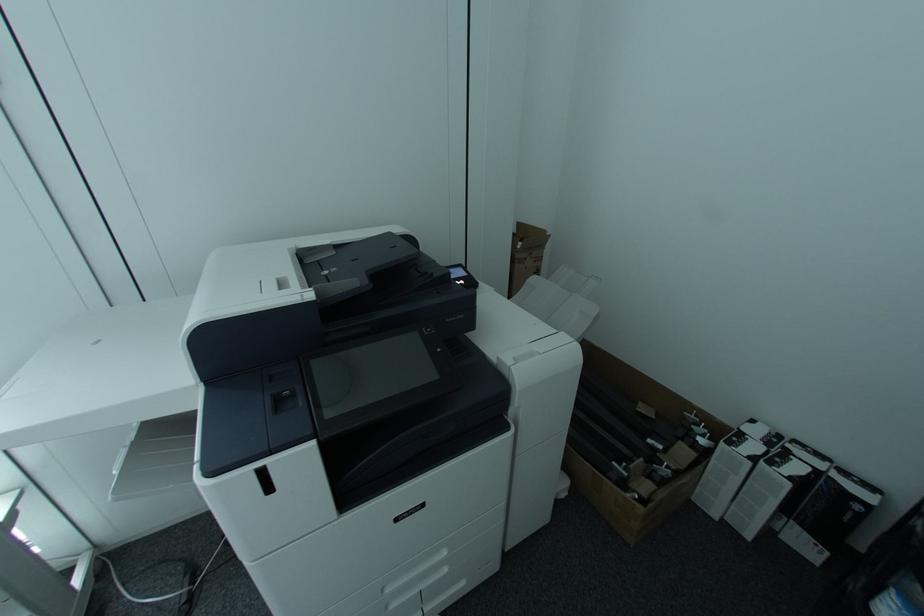
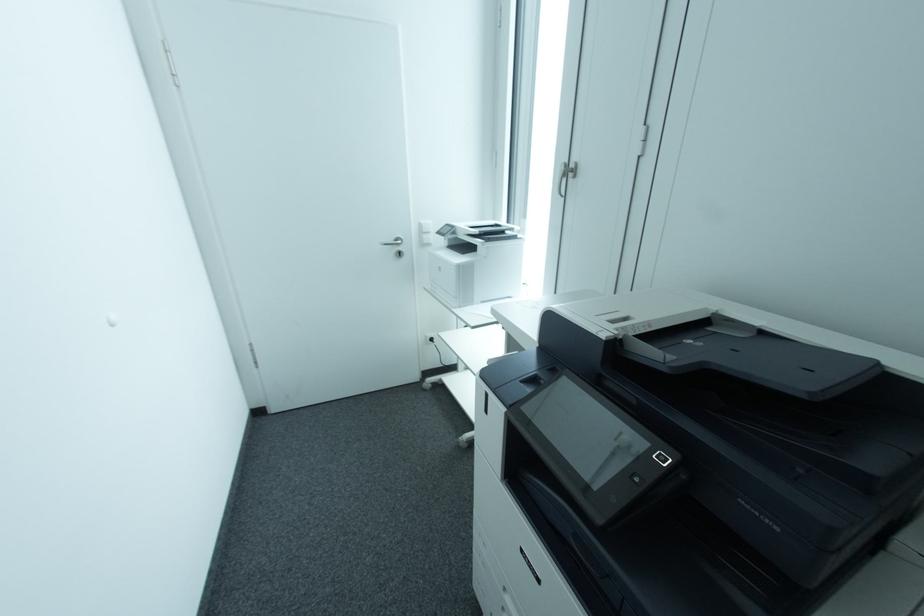
The first image is from the beginning of the video and the second image is from the end. How did the camera likely rotate when shooting the video?

The rotation direction of the camera is left-down.